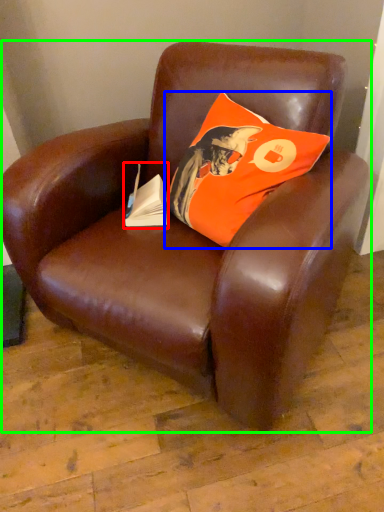
Question: Which is nearer to the paperback book (highlighted by a red box)? pillow (highlighted by a blue box) or chair (highlighted by a green box).

Choices:
 (A) pillow
 (B) chair

Answer: (A)